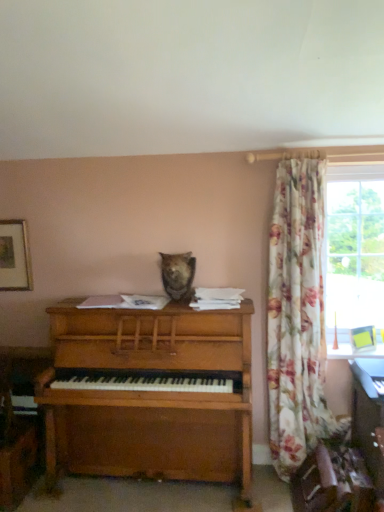
Question: Considering the relative positions of wooden desk at lower right and floral fabric curtain at right in the image provided, is wooden desk at lower right to the left or to the right of floral fabric curtain at right?

Choices:
 (A) right
 (B) left

Answer: (A)

Question: In terms of width, does wooden desk at lower right look wider or thinner when compared to floral fabric curtain at right?

Choices:
 (A) thin
 (B) wide

Answer: (A)

Question: Considering the real-world distances, which object is closest to the wooden piano at center?

Choices:
 (A) fuzzy brown bear at center
 (B) floral fabric curtain at right
 (C) wooden framed picture at upper left
 (D) wooden desk at lower right

Answer: (A)

Question: Considering the real-world distances, which object is closest to the wooden desk at lower right?

Choices:
 (A) floral fabric curtain at right
 (B) fuzzy brown bear at center
 (C) wooden framed picture at upper left
 (D) wooden piano at center

Answer: (A)